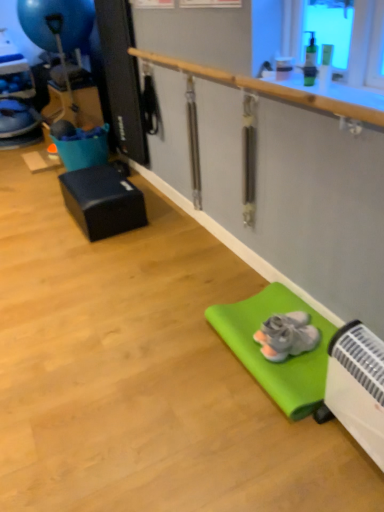
Question: Does gray suede sneakers at lower right have a lesser width compared to wooden rail at upper center?

Choices:
 (A) yes
 (B) no

Answer: (B)

Question: Is gray suede sneakers at lower right shorter than wooden rail at upper center?

Choices:
 (A) no
 (B) yes

Answer: (B)

Question: Is gray suede sneakers at lower right to the left of wooden rail at upper center from the viewer's perspective?

Choices:
 (A) no
 (B) yes

Answer: (A)

Question: Is gray suede sneakers at lower right placed right next to wooden rail at upper center?

Choices:
 (A) yes
 (B) no

Answer: (B)

Question: From a real-world perspective, is gray suede sneakers at lower right beneath wooden rail at upper center?

Choices:
 (A) no
 (B) yes

Answer: (B)

Question: Is gray suede sneakers at lower right turned away from wooden rail at upper center?

Choices:
 (A) no
 (B) yes

Answer: (A)

Question: Does wooden rail at upper center turn towards black matte cube at left?

Choices:
 (A) yes
 (B) no

Answer: (B)

Question: Is wooden rail at upper center wider than black matte cube at left?

Choices:
 (A) no
 (B) yes

Answer: (A)

Question: Is wooden rail at upper center next to black matte cube at left?

Choices:
 (A) no
 (B) yes

Answer: (A)

Question: Is wooden rail at upper center shorter than black matte cube at left?

Choices:
 (A) yes
 (B) no

Answer: (A)

Question: Is the position of wooden rail at upper center more distant than that of black matte cube at left?

Choices:
 (A) no
 (B) yes

Answer: (A)

Question: Is wooden rail at upper center to the left of black matte cube at left from the viewer's perspective?

Choices:
 (A) yes
 (B) no

Answer: (B)

Question: Does blue rubber balloon at upper left have a greater width compared to green rubber yoga mat at lower right?

Choices:
 (A) no
 (B) yes

Answer: (B)